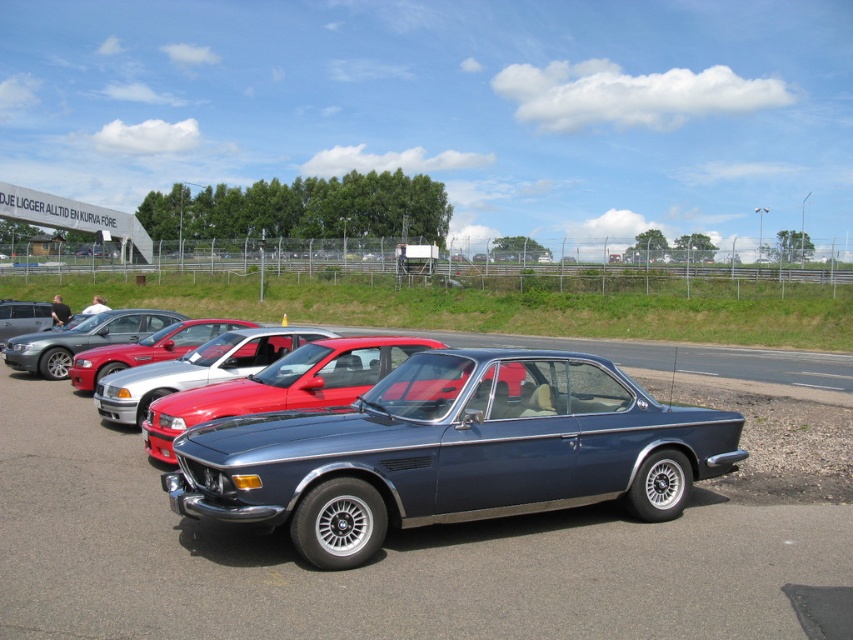
You are at a car show and want to know which car is shorter between the metallic blue car at center and the glossy metallic car at center. Which one is shorter?

The metallic blue car at center is not as tall as glossy metallic car at center, so the metallic blue car at center is shorter.

You are at a car show and see the shiny red car at center and the silver metallic sedan at center. Which one is bigger?

The shiny red car at center is smaller than the silver metallic sedan at center.

You are a photographer planning to take a group photo of the satin blue car at center and the shiny red car at center. Since you want both cars to appear the same size in the photo, which car should you move closer to the camera?

Since the satin blue car at center is larger in size than the shiny red car at center, you should move the satin blue car at center closer to the camera to make them appear the same size in the photo.